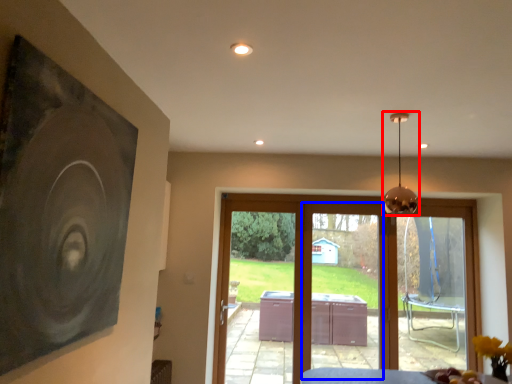
Question: Which of the following is the closest to the observer, lamp (highlighted by a red box) or screen door (highlighted by a blue box)?

Choices:
 (A) lamp
 (B) screen door

Answer: (A)